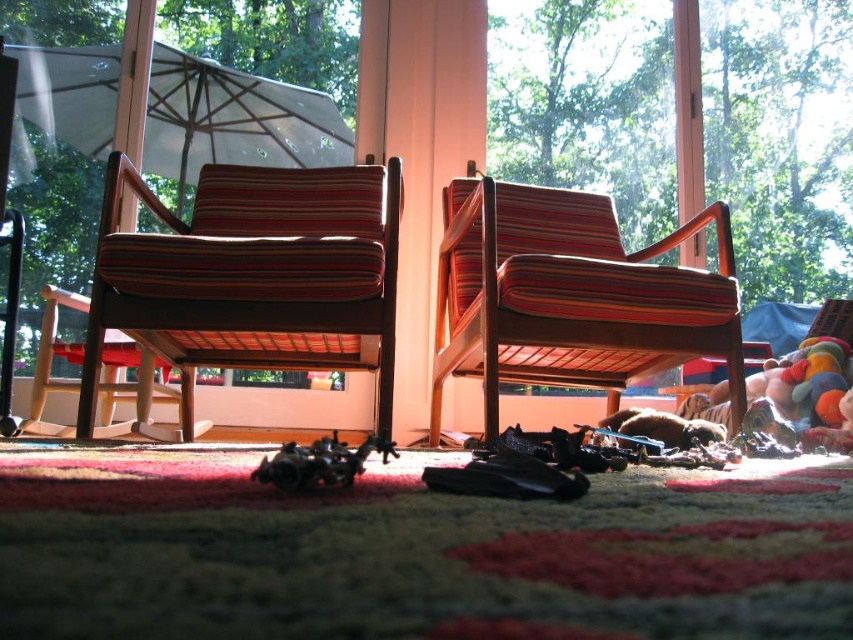
Is point (184, 140) positioned behind point (338, 481)?

Yes.

At what (x,y) coordinates should I click in order to perform the action: click on white fabric umbrella at upper left. Please return your answer as a coordinate pair (x, y). This screenshot has width=853, height=640. Looking at the image, I should click on (233, 120).

Does striped fabric chair at left have a greater width compared to striped fabric chair at center?

No.

Can you confirm if striped fabric chair at left is thinner than striped fabric chair at center?

Correct, striped fabric chair at left's width is less than striped fabric chair at center's.

Describe the element at coordinates (253, 276) in the screenshot. This screenshot has width=853, height=640. I see `striped fabric chair at left` at that location.

Identify the location of striped fabric chair at left. The height and width of the screenshot is (640, 853). (253, 276).

Consider the image. Does striped fabric chair at left appear on the right side of metallic black toy car at center?

Incorrect, striped fabric chair at left is not on the right side of metallic black toy car at center.

Is striped fabric chair at left positioned behind metallic black toy car at center?

Yes, striped fabric chair at left is further from the viewer.

Is point (390, 320) farther from camera compared to point (381, 461)?

Yes, point (390, 320) is farther from viewer.

Where is `striped fabric chair at left`? striped fabric chair at left is located at coordinates (253, 276).